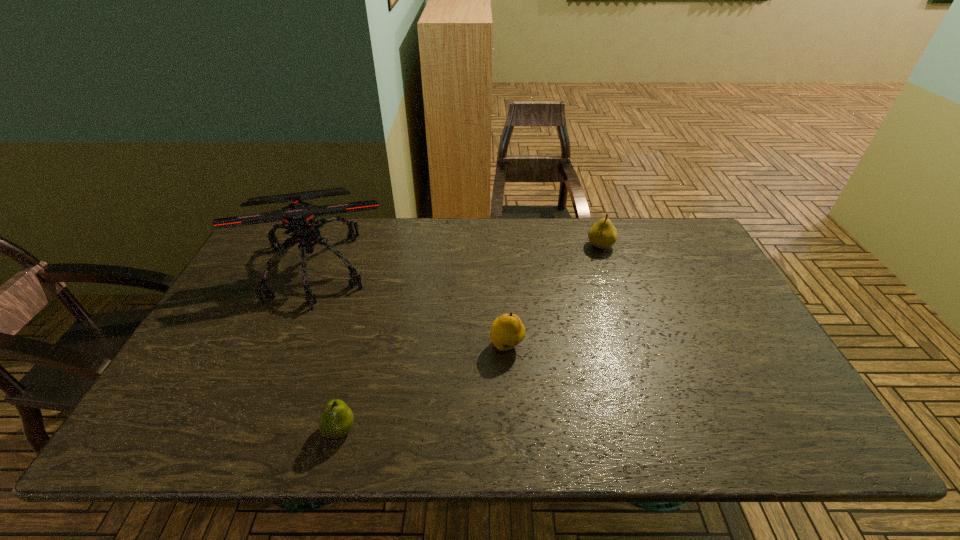
In order to click on vacant space situated on the back of the nearest pear in this screenshot , I will do `click(372, 304)`.

You are a GUI agent. You are given a task and a screenshot of the screen. Output one action in this format:
    pyautogui.click(x=<x>, y=<y>)
    Task: Click on the drone that is at the far edge
    
    Given the screenshot: What is the action you would take?
    pyautogui.click(x=298, y=217)

Where is `pear that is at the far edge`? The image size is (960, 540). pear that is at the far edge is located at coordinates (603, 234).

The width and height of the screenshot is (960, 540). Identify the location of object that is at the near edge. (336, 419).

The image size is (960, 540). In order to click on object that is at the left edge in this screenshot , I will do `click(298, 217)`.

Locate an element on the screen. object that is at the far left corner is located at coordinates (298, 217).

This screenshot has width=960, height=540. I want to click on vacant region at the far edge, so click(553, 246).

This screenshot has height=540, width=960. I want to click on vacant space at the near edge, so click(x=405, y=446).

Locate an element on the screen. The height and width of the screenshot is (540, 960). free space at the left edge is located at coordinates (276, 263).

At what (x,y) coordinates should I click in order to perform the action: click on vacant space at the right edge. Please return your answer as a coordinate pair (x, y). Looking at the image, I should click on (683, 272).